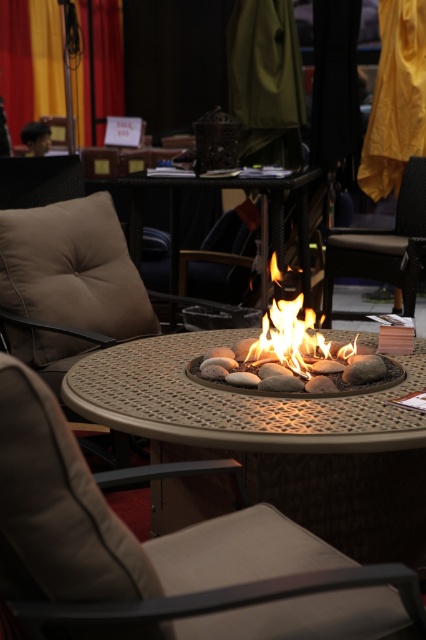
You are planning to rearrange the seating around the fire pit table. You have a beige fabric armchair at center and a black leather armchair at center. Which chair takes up more space in the seating area?

The black leather armchair at center occupies more space than the beige fabric armchair at center, so it takes up more space in the seating area.

You are standing at the center of the fire pit and want to move to the point marked at coordinate (230, 188). Is this point the same as your current location?

Yes, the metallic fire pit at center is located at point (230, 188), so the point is your current location.